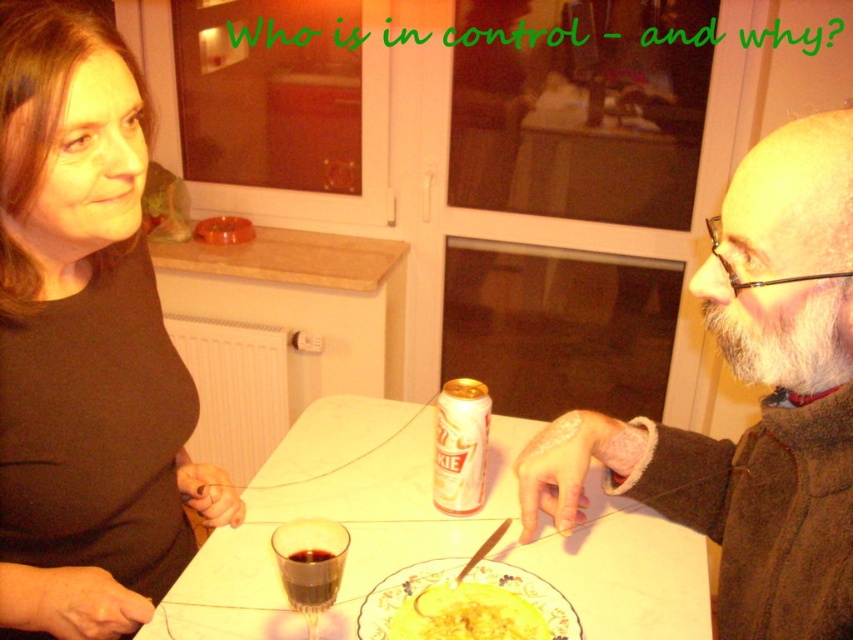
You are a photographer trying to capture a candid shot of both the brown matte shirt at upper left and the dark glass at center. Since you can only focus on one object at a time, which object should you focus on to ensure the other is still in the frame?

The brown matte shirt at upper left is to the left of dark glass at center. Therefore, focusing on the dark glass at center would keep the brown matte shirt at upper left within the frame, as it is positioned to the left of the focused object.

You are trying to decide whether to place a new decorative item on the table between the brown matte shirt at upper left and the yellow matte plate at center. The item is 15 cm wide. Can you fit it there?

The brown matte shirt at upper left might be wider than yellow matte plate at center, so the space between them may be sufficient to fit the 15 cm wide item. However, since the exact width difference isn